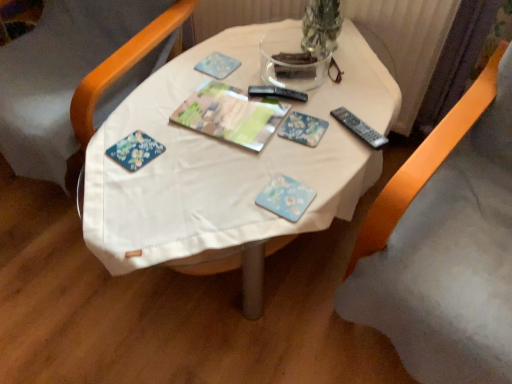
Question: Could black plastic remote at right be considered to be inside blue floral coaster at center, the 1th paperback book from the front?

Choices:
 (A) yes
 (B) no

Answer: (B)

Question: Is blue floral coaster at center, which is the second paperback book from top to bottom, not close to black plastic remote at right?

Choices:
 (A) yes
 (B) no

Answer: (B)

Question: From a real-world perspective, is blue floral coaster at center, the 2th paperback book viewed from the back, located beneath black plastic remote at right?

Choices:
 (A) no
 (B) yes

Answer: (B)

Question: From the image's perspective, is blue floral coaster at center, the 2th paperback book viewed from the back, on top of black plastic remote at right?

Choices:
 (A) yes
 (B) no

Answer: (B)

Question: Can we say blue floral coaster at center, arranged as the first paperback book when ordered from the bottom, lies outside black plastic remote at right?

Choices:
 (A) yes
 (B) no

Answer: (A)

Question: Is blue floral coaster at center, arranged as the first paperback book when ordered from the bottom, to the right of black plastic remote at right from the viewer's perspective?

Choices:
 (A) yes
 (B) no

Answer: (B)

Question: Is floral paper magazine at center to the right of blue floral coaster at center, the 2th paperback book viewed from the back, from the viewer's perspective?

Choices:
 (A) yes
 (B) no

Answer: (B)

Question: Is floral paper magazine at center turned away from blue floral coaster at center, which is the second paperback book from top to bottom?

Choices:
 (A) no
 (B) yes

Answer: (A)

Question: Considering the relative positions of floral paper magazine at center and blue floral coaster at center, arranged as the first paperback book when ordered from the bottom, in the image provided, is floral paper magazine at center to the left of blue floral coaster at center, arranged as the first paperback book when ordered from the bottom, from the viewer's perspective?

Choices:
 (A) yes
 (B) no

Answer: (A)

Question: From a real-world perspective, is floral paper magazine at center physically above blue floral coaster at center, which is the second paperback book from top to bottom?

Choices:
 (A) no
 (B) yes

Answer: (B)

Question: Considering the relative sizes of floral paper magazine at center and blue floral coaster at center, arranged as the first paperback book when ordered from the bottom, in the image provided, is floral paper magazine at center shorter than blue floral coaster at center, arranged as the first paperback book when ordered from the bottom,?

Choices:
 (A) no
 (B) yes

Answer: (A)

Question: Is floral paper magazine at center not close to blue floral coaster at center, the 2th paperback book viewed from the back?

Choices:
 (A) yes
 (B) no

Answer: (B)

Question: Does blue floral coaster at center, the 2th paperback book viewed from the back, have a greater width compared to floral-patterned paper at center, placed as the 2th paperback book when sorted from bottom to top?

Choices:
 (A) yes
 (B) no

Answer: (B)